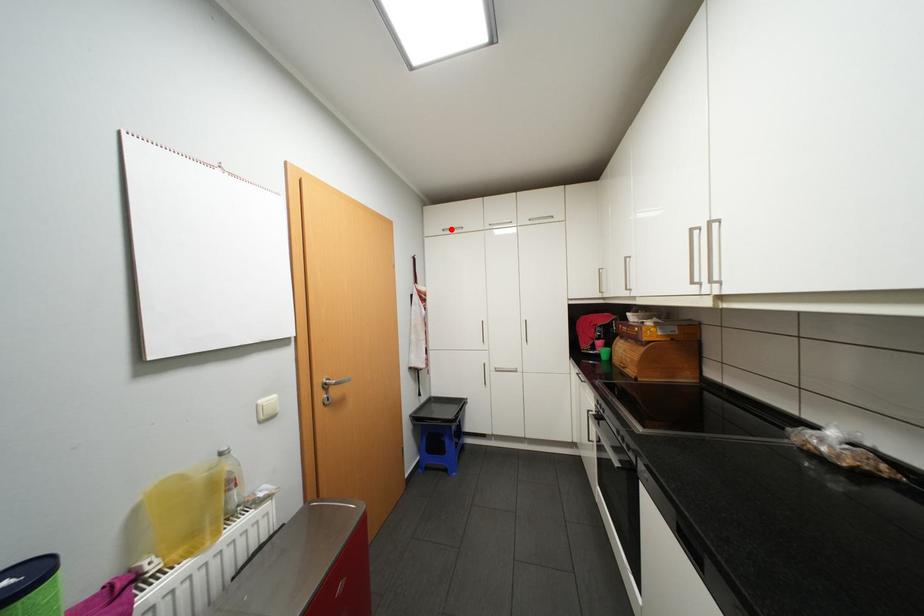
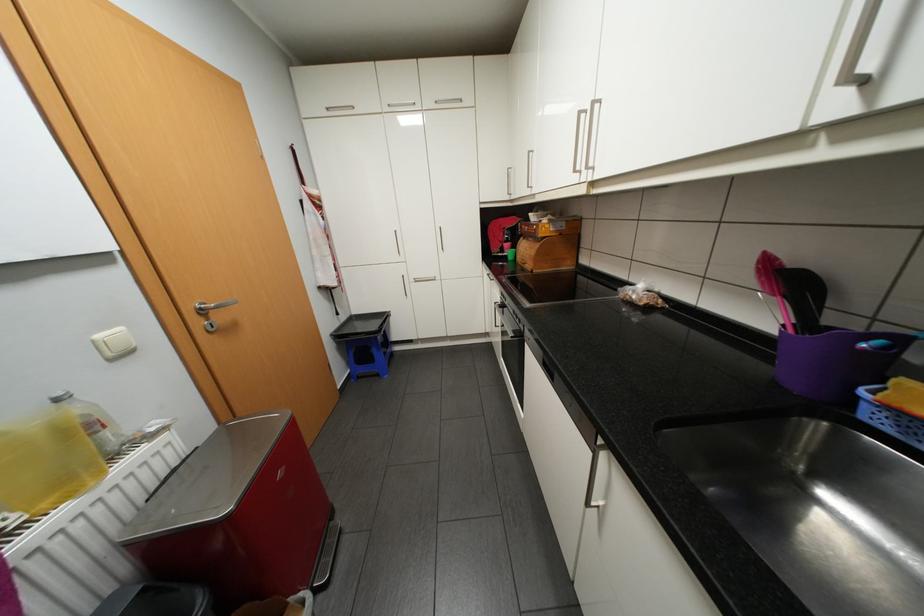
The point at the highlighted location is marked in the first image. Where is the corresponding point in the second image?

(335, 108)